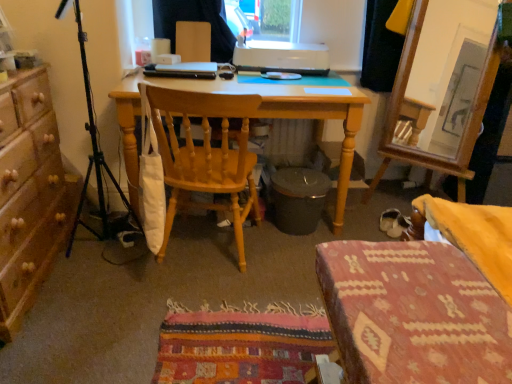
The image size is (512, 384). What do you see at coordinates (282, 57) in the screenshot?
I see `white plastic printer at upper center` at bounding box center [282, 57].

What do you see at coordinates (183, 70) in the screenshot? The height and width of the screenshot is (384, 512). I see `black matte laptop at center` at bounding box center [183, 70].

At what (x,y) coordinates should I click in order to perform the action: click on textured woolen stool at lower right. Please return your answer as a coordinate pair (x, y). Looking at the image, I should click on (413, 314).

Locate an element on the screen. Image resolution: width=512 pixels, height=384 pixels. dark gray plastic trash bin/can at center is located at coordinates (298, 199).

Does white plastic printer at upper center turn towards light wood desk at center?

No.

Which object is further away from the camera, white plastic printer at upper center or light wood desk at center?

white plastic printer at upper center.

Which of these two, white plastic printer at upper center or light wood desk at center, is wider?

light wood desk at center is wider.

Can you confirm if white plastic printer at upper center is positioned to the right of light wood desk at center?

Indeed, white plastic printer at upper center is positioned on the right side of light wood desk at center.

The image size is (512, 384). In order to click on trash bin/can on the right of wooden chair at center in this screenshot , I will do `click(298, 199)`.

Which is more to the left, wooden chair at center or dark gray plastic trash bin/can at center?

Positioned to the left is wooden chair at center.

Can you confirm if wooden chair at center is shorter than dark gray plastic trash bin/can at center?

Incorrect, the height of wooden chair at center does not fall short of that of dark gray plastic trash bin/can at center.

Consider the image. From a real-world perspective, is wooden chair at center physically located above or below dark gray plastic trash bin/can at center?

From a real-world perspective, wooden chair at center is physically above dark gray plastic trash bin/can at center.

Considering the relative sizes of white suede shoe at lower right and light wood desk at center in the image provided, is white suede shoe at lower right smaller than light wood desk at center?

Indeed, white suede shoe at lower right has a smaller size compared to light wood desk at center.

Choose the correct answer: Is white suede shoe at lower right inside light wood desk at center or outside it?

white suede shoe at lower right is located beyond the bounds of light wood desk at center.

From the picture: Is white suede shoe at lower right positioned far away from light wood desk at center?

white suede shoe at lower right is actually quite close to light wood desk at center.

Is wooden dresser at left wider or thinner than black matte tripod at left?

In the image, wooden dresser at left appears to be wider than black matte tripod at left.

Between wooden dresser at left and black matte tripod at left, which one has smaller size?

black matte tripod at left.

Based on the photo, is wooden dresser at left not near black matte tripod at left?

No, wooden dresser at left is in close proximity to black matte tripod at left.

Between wooden dresser at left and black matte tripod at left, which one is positioned in front?

Positioned in front is wooden dresser at left.

Is dark gray plastic trash bin/can at center facing away from white suede shoe at lower right?

No.

Is dark gray plastic trash bin/can at center in contact with white suede shoe at lower right?

dark gray plastic trash bin/can at center and white suede shoe at lower right are clearly separated.

Is dark gray plastic trash bin/can at center completely or partially outside of white suede shoe at lower right?

Indeed, dark gray plastic trash bin/can at center is completely outside white suede shoe at lower right.

What's the angular difference between dark gray plastic trash bin/can at center and white suede shoe at lower right's facing directions?

The facing directions of dark gray plastic trash bin/can at center and white suede shoe at lower right are 39.9 degrees apart.

Locate an element on the screen. The width and height of the screenshot is (512, 384). footwear that is below the wooden chair at center (from the image's perspective) is located at coordinates (388, 219).

Is white suede shoe at lower right a part of wooden chair at center?

That's incorrect, white suede shoe at lower right is not inside wooden chair at center.

From the image's perspective, is white suede shoe at lower right below black matte laptop at center?

Yes, from the image's perspective, white suede shoe at lower right is below black matte laptop at center.

Can you confirm if white suede shoe at lower right is shorter than black matte laptop at center?

Incorrect, the height of white suede shoe at lower right does not fall short of that of black matte laptop at center.

Does white suede shoe at lower right have a smaller size compared to black matte laptop at center?

Indeed, white suede shoe at lower right has a smaller size compared to black matte laptop at center.

Is white suede shoe at lower right positioned beyond the bounds of black matte laptop at center?

Yes, white suede shoe at lower right is not within black matte laptop at center.

Identify the location of desk on the left of white plastic printer at upper center. The height and width of the screenshot is (384, 512). (256, 116).

Find the location of a particular element. Image resolution: width=512 pixels, height=384 pixels. chair above the dark gray plastic trash bin/can at center (from the image's perspective) is located at coordinates (206, 155).

When comparing their distances from light wood desk at center, does black matte tripod at left or dark gray plastic trash bin/can at center seem closer?

Among the two, dark gray plastic trash bin/can at center is located nearer to light wood desk at center.

From the image, which object appears to be nearer to wooden dresser at left, black matte laptop at center or dark gray plastic trash bin/can at center?

black matte laptop at center lies closer to wooden dresser at left than the other object.

Which object lies nearer to the anchor point wooden chair at center, white plastic printer at upper center or textured woolen stool at lower right?

Based on the image, white plastic printer at upper center appears to be nearer to wooden chair at center.

Which object lies nearer to the anchor point black matte tripod at left, white plastic printer at upper center or black matte laptop at center?

black matte laptop at center is positioned closer to the anchor black matte tripod at left.

Consider the image. Considering their positions, is wooden dresser at left positioned closer to dark gray plastic trash bin/can at center than white suede shoe at lower right?

Based on the image, white suede shoe at lower right appears to be nearer to dark gray plastic trash bin/can at center.

Which object lies nearer to the anchor point white suede shoe at lower right, dark gray plastic trash bin/can at center or black matte tripod at left?

Among the two, dark gray plastic trash bin/can at center is located nearer to white suede shoe at lower right.

Estimate the real-world distances between objects in this image. Which object is further from black matte laptop at center, wooden chair at center or wooden dresser at left?

Based on the image, wooden dresser at left appears to be further to black matte laptop at center.

When comparing their distances from wooden dresser at left, does dark gray plastic trash bin/can at center or textured woolen stool at lower right seem further?

Based on the image, textured woolen stool at lower right appears to be further to wooden dresser at left.

Locate an element on the screen. Image resolution: width=512 pixels, height=384 pixels. desk between white plastic printer at upper center and dark gray plastic trash bin/can at center vertically is located at coordinates (256, 116).

What are the coordinates of `chair located between textured woolen stool at lower right and white plastic printer at upper center in the depth direction` in the screenshot? It's located at (206, 155).

At what (x,y) coordinates should I click in order to perform the action: click on tripod located between wooden dresser at left and black matte laptop at center in the depth direction. Please return your answer as a coordinate pair (x, y). This screenshot has height=384, width=512. Looking at the image, I should click on (93, 149).

At what (x,y) coordinates should I click in order to perform the action: click on chair between black matte tripod at left and textured woolen stool at lower right from left to right. Please return your answer as a coordinate pair (x, y). Looking at the image, I should click on (206, 155).